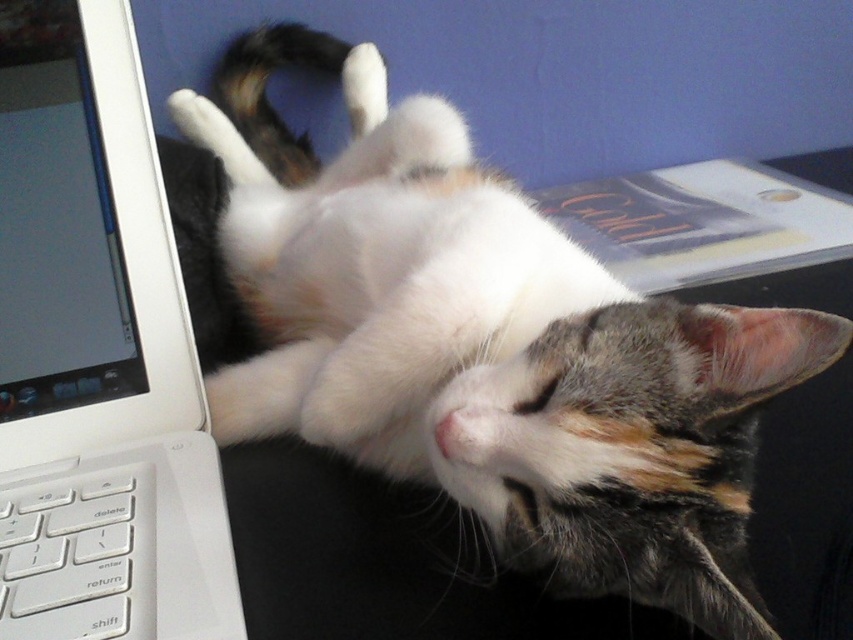
You are organizing a study space and need to place a 15 cm tall textbook between the white plastic laptop at left and the white plastic keyboard at lower left. Can the textbook fit vertically between them without overlapping?

The white plastic laptop at left is taller than the white plastic keyboard at lower left. Since the textbook is 15 cm tall, it can fit vertically between them as long as the vertical space between the two objects allows for that height. However, the exact positioning depends on their arrangement in the scene.

You are organizing a space and need to place a small plant between the white plastic laptop at left and the white plastic keyboard at lower left. Can the plant fit horizontally between them?

The white plastic laptop at left might be wider than the white plastic keyboard at lower left, so there might not be enough space for the plant to fit horizontally between them.

You are looking at the image of the cat and the laptop. There are two points marked in the image. Which point is closer to you, point 1 at coordinates point (120, 209) or point 2 at coordinates point (65, 564)?

Point 1 at coordinates point (120, 209) is closer to you than point 2 at coordinates point (65, 564) because the description states that point (120, 209) is further to the camera than point (65, 564).